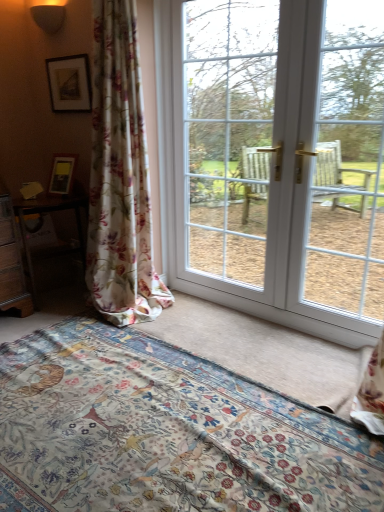
You are a GUI agent. You are given a task and a screenshot of the screen. Output one action in this format:
    pyautogui.click(x=<x>, y=<y>)
    Task: Click on the vacant region to the right of floral fabric curtain at left
    
    Given the screenshot: What is the action you would take?
    pyautogui.click(x=189, y=321)